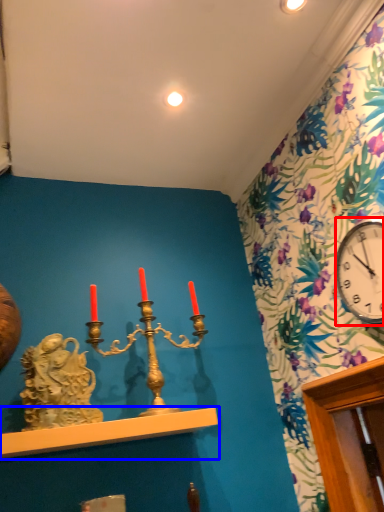
Question: Which point is further to the camera, clock (highlighted by a red box) or shelf (highlighted by a blue box)?

Choices:
 (A) clock
 (B) shelf

Answer: (B)